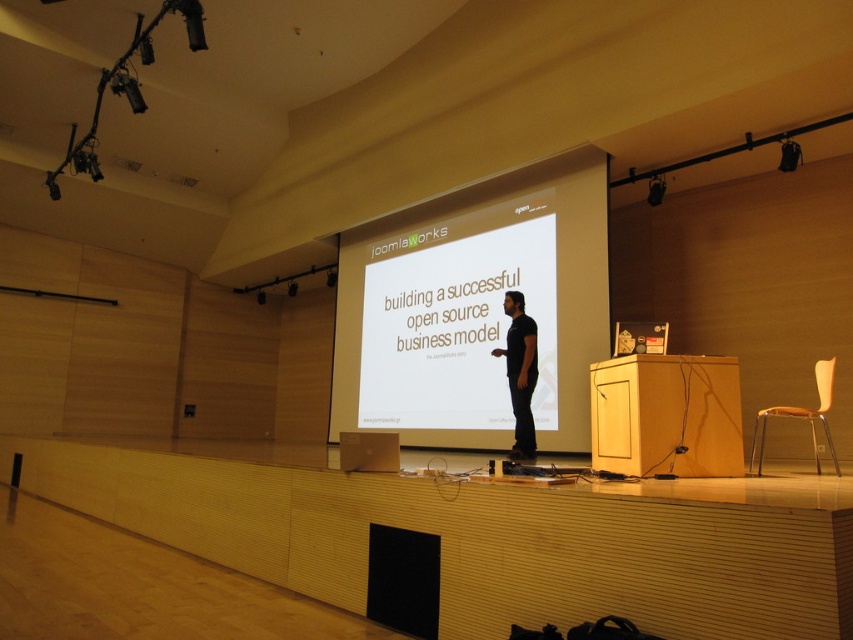
Who is lower down, white matte projection screen at center or dark brown leather jacket at center?

dark brown leather jacket at center is below.

Which is more to the left, white matte projection screen at center or dark brown leather jacket at center?

Positioned to the left is white matte projection screen at center.

Measure the distance between point (450, 216) and camera.

8.71 meters

You are a GUI agent. You are given a task and a screenshot of the screen. Output one action in this format:
    pyautogui.click(x=<x>, y=<y>)
    Task: Click on the white matte projection screen at center
    This screenshot has height=640, width=853.
    Given the screenshot: What is the action you would take?
    pyautogui.click(x=474, y=308)